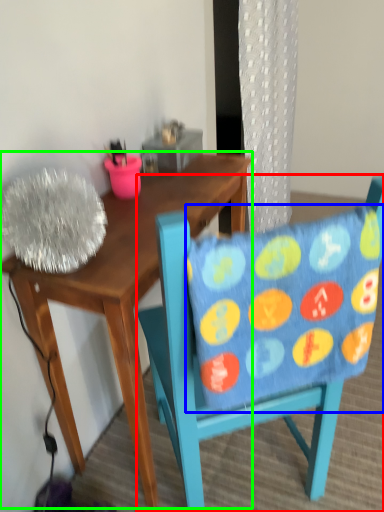
Question: Which object is the farthest from chair (highlighted by a red box)? Choose among these: pillow (highlighted by a blue box) or desk (highlighted by a green box).

Choices:
 (A) pillow
 (B) desk

Answer: (B)